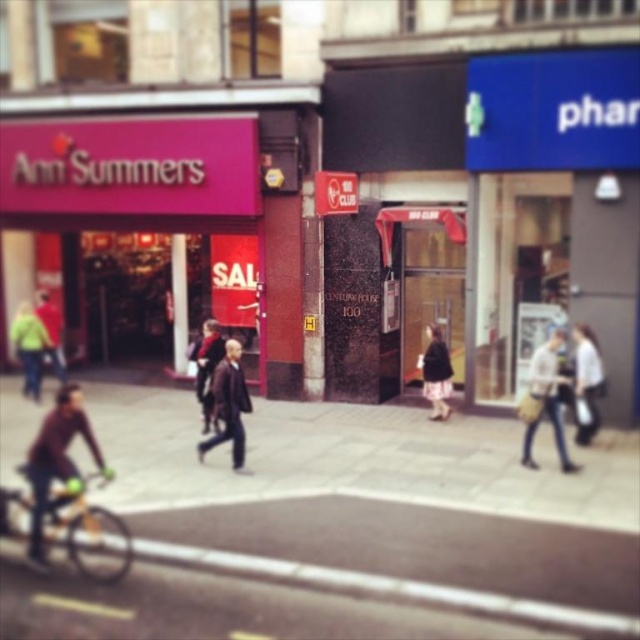
Question: Which object appears closest to the camera in this image?

Choices:
 (A) yellow matte bicycle at lower left
 (B) dark brown leather coat at center

Answer: (A)

Question: Which of these objects is positioned farthest from the matte black jacket at center?

Choices:
 (A) light brown leather bag at right
 (B) black leather jacket at center

Answer: (A)

Question: Considering the relative positions of green fabric jacket at left and dark brown leather coat at center in the image provided, where is green fabric jacket at left located with respect to dark brown leather coat at center?

Choices:
 (A) below
 (B) above

Answer: (B)

Question: Which object is farther from the camera taking this photo?

Choices:
 (A) white fabric bag at center
 (B) green fabric jacket at left
 (C) matte black jacket at center
 (D) yellow matte bicycle at lower left

Answer: (C)

Question: Is dark brown leather coat at center positioned behind matte black jacket at center?

Choices:
 (A) yes
 (B) no

Answer: (B)

Question: Is matte brown jacket at lower left positioned before green fabric jacket at left?

Choices:
 (A) yes
 (B) no

Answer: (A)